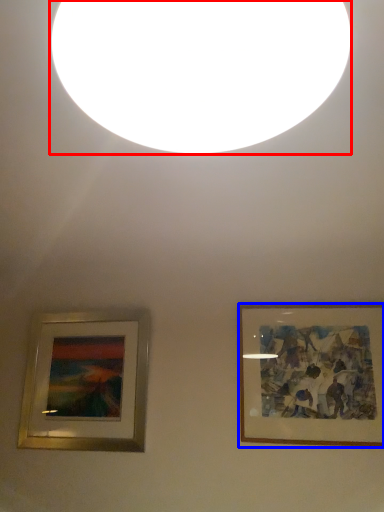
Question: Which of the following is the farthest to the observer, lighting (highlighted by a red box) or picture frame (highlighted by a blue box)?

Choices:
 (A) lighting
 (B) picture frame

Answer: (B)